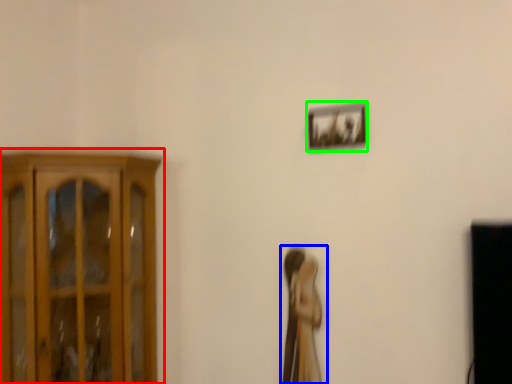
Question: Which is farther away from cupboard (highlighted by a red box)? woman (highlighted by a blue box) or picture frame (highlighted by a green box)?

Choices:
 (A) woman
 (B) picture frame

Answer: (B)